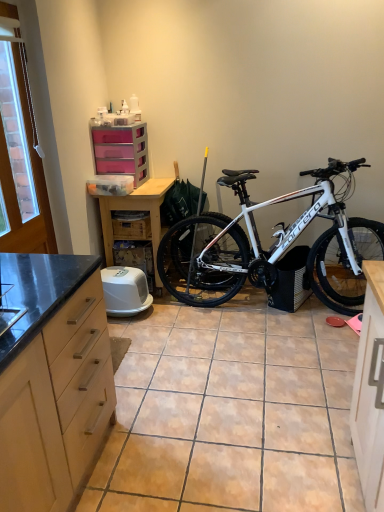
What is the approximate width of brown tile at center?

The width of brown tile at center is 7.93 feet.

Describe the element at coordinates (230, 412) in the screenshot. The height and width of the screenshot is (512, 384). I see `brown tile at center` at that location.

What do you see at coordinates (131, 225) in the screenshot? This screenshot has height=512, width=384. I see `wooden crate at center` at bounding box center [131, 225].

This screenshot has width=384, height=512. I want to click on wooden crate at center, so tap(131, 225).

Measure the distance between white plastic chain at upper left and camera.

The depth of white plastic chain at upper left is 7.69 feet.

What are the coordinates of `white plastic litter box at center` in the screenshot? It's located at (125, 291).

Could you tell me if white matte bicycle at center-right is facing wooden table at center?

No, white matte bicycle at center-right is not turned towards wooden table at center.

Which is farther, (347,314) or (164,184)?

The point (164,184) is farther from the camera.

Is white matte bicycle at center-right thinner than wooden table at center?

Indeed, white matte bicycle at center-right has a lesser width compared to wooden table at center.

Who is taller, white plastic litter box at center or white matte bicycle at center-right?

white matte bicycle at center-right.

Where is `appliance below the white matte bicycle at center-right (from a real-world perspective)`? This screenshot has width=384, height=512. appliance below the white matte bicycle at center-right (from a real-world perspective) is located at coordinates (125, 291).

In the scene shown: Does white plastic litter box at center touch white matte bicycle at center-right?

No, white plastic litter box at center is not next to white matte bicycle at center-right.

Between white plastic litter box at center and white matte bicycle at center-right, which one has larger size?

A: white matte bicycle at center-right.

Looking at this image, considering the sizes of objects matte wood cabinet at left and wooden table at center in the image provided, who is bigger, matte wood cabinet at left or wooden table at center?

matte wood cabinet at left.

Which of these two, matte wood cabinet at left or wooden table at center, is thinner?

wooden table at center.

From the image's perspective, is matte wood cabinet at left located above or below wooden table at center?

Based on their image positions, matte wood cabinet at left is located beneath wooden table at center.

Which object is closer to the camera taking this photo, pink plastic chest of drawers at upper center or white plastic chain at upper left?

white plastic chain at upper left is closer to the camera.

Can you confirm if pink plastic chest of drawers at upper center is thinner than white plastic chain at upper left?

In fact, pink plastic chest of drawers at upper center might be wider than white plastic chain at upper left.

From the image's perspective, which is above, pink plastic chest of drawers at upper center or white plastic chain at upper left?

white plastic chain at upper left is shown above in the image.

Which is nearer, (144, 185) or (14, 143)?

Point (144, 185) appears to be farther away from the viewer than point (14, 143).

Is wooden table at center located outside white plastic chain at upper left?

Indeed, wooden table at center is completely outside white plastic chain at upper left.

Based on the photo, can you confirm if wooden table at center is positioned to the right of white plastic chain at upper left?

Yes.

You are a GUI agent. You are given a task and a screenshot of the screen. Output one action in this format:
    pyautogui.click(x=<x>, y=<y>)
    Task: Click on the appliance below the wooden crate at center (from a real-world perspective)
    The image size is (384, 512).
    Given the screenshot: What is the action you would take?
    pyautogui.click(x=125, y=291)

In the scene shown: Is wooden crate at center oriented towards white plastic litter box at center?

No, wooden crate at center does not turn towards white plastic litter box at center.

How far apart are wooden crate at center and white plastic litter box at center?

wooden crate at center and white plastic litter box at center are 17.17 inches apart.

Looking at this image, from a real-world perspective, is wooden crate at center positioned over white plastic litter box at center based on gravity?

Yes, from a real-world perspective, wooden crate at center is above white plastic litter box at center.

From the image's perspective, would you say pink plastic chest of drawers at upper center is shown under white plastic litter box at center?

No, from the image's perspective, pink plastic chest of drawers at upper center is not below white plastic litter box at center.

Considering the positions of point (123, 170) and point (133, 301), is point (123, 170) closer or farther from the camera than point (133, 301)?

Point (123, 170) is positioned farther from the camera compared to point (133, 301).

Can you confirm if pink plastic chest of drawers at upper center is shorter than white plastic litter box at center?

Incorrect, the height of pink plastic chest of drawers at upper center does not fall short of that of white plastic litter box at center.

Is pink plastic chest of drawers at upper center thinner than white plastic litter box at center?

Yes, pink plastic chest of drawers at upper center is thinner than white plastic litter box at center.

Identify the location of table that appears behind the white matte bicycle at center-right. (135, 210).

Image resolution: width=384 pixels, height=512 pixels. Find the location of `appliance to the left of white matte bicycle at center-right`. appliance to the left of white matte bicycle at center-right is located at coordinates (125, 291).

Considering their positions, is white plastic litter box at center positioned closer to white matte bicycle at center-right than matte wood cabinet at left?

Based on the image, white plastic litter box at center appears to be nearer to white matte bicycle at center-right.

When comparing their distances from white matte bicycle at center-right, does wooden table at center or white plastic chain at upper left seem closer?

The object closer to white matte bicycle at center-right is wooden table at center.

Which object lies further to the anchor point wooden crate at center, white plastic litter box at center or white plastic chain at upper left?

white plastic chain at upper left is positioned further to the anchor wooden crate at center.

When comparing their distances from white matte bicycle at center-right, does white plastic chain at upper left or white plastic litter box at center seem closer?

white plastic litter box at center is positioned closer to the anchor white matte bicycle at center-right.

Considering their positions, is wooden crate at center positioned closer to white plastic litter box at center than white plastic chain at upper left?

The object closer to white plastic litter box at center is wooden crate at center.

Based on their spatial positions, is matte wood cabinet at left or white plastic litter box at center further from pink plastic chest of drawers at upper center?

matte wood cabinet at left is positioned further to the anchor pink plastic chest of drawers at upper center.

Looking at the image, which one is located further to pink plastic chest of drawers at upper center, white plastic litter box at center or white plastic chain at upper left?

Based on the image, white plastic litter box at center appears to be further to pink plastic chest of drawers at upper center.

Looking at the image, which one is located further to brown tile at center, white plastic litter box at center or matte wood cabinet at left?

white plastic litter box at center lies further to brown tile at center than the other object.

Locate an element on the screen. window screen between matte wood cabinet at left and wooden crate at center from front to back is located at coordinates (16, 135).

Locate an element on the screen. bicycle located between brown tile at center and white plastic litter box at center in the depth direction is located at coordinates (271, 247).

The image size is (384, 512). In order to click on appliance between brown tile at center and wooden crate at center in the front-back direction in this screenshot , I will do (x=125, y=291).

Locate an element on the screen. appliance between matte wood cabinet at left and wooden table at center from front to back is located at coordinates (125, 291).